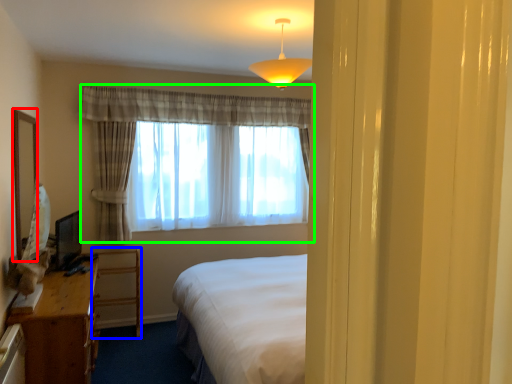
Question: Which object is positioned farthest from mirror (highlighted by a red box)? Select from furniture (highlighted by a blue box) and curtain (highlighted by a green box).

Choices:
 (A) furniture
 (B) curtain

Answer: (B)